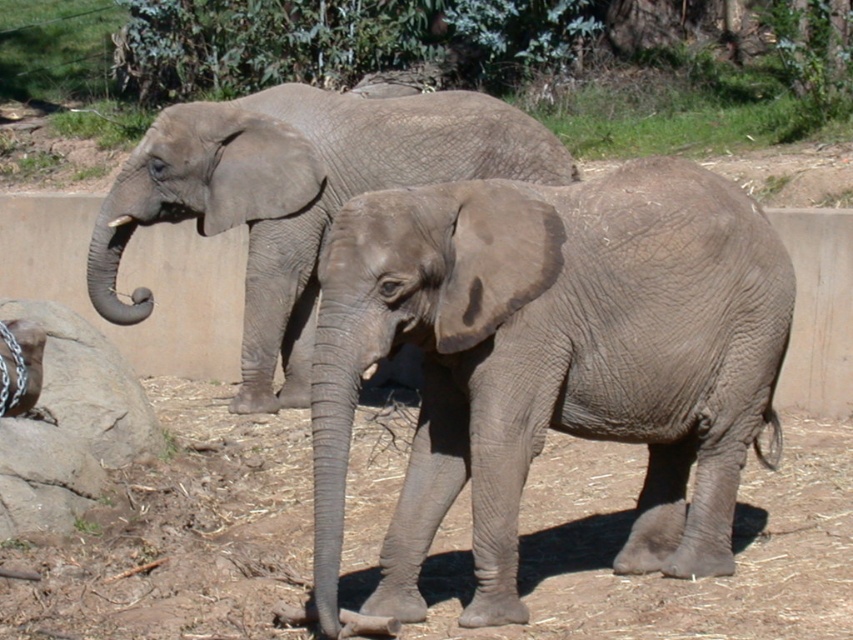
Is gray matte elephant at center to the right of gray matte elephant at upper left from the viewer's perspective?

Correct, you'll find gray matte elephant at center to the right of gray matte elephant at upper left.

Can you confirm if gray matte elephant at center is taller than gray matte elephant at upper left?

In fact, gray matte elephant at center may be shorter than gray matte elephant at upper left.

In the scene shown: Who is more distant from viewer, (732,561) or (252,161)?

Point (252,161)

This screenshot has width=853, height=640. I want to click on gray matte elephant at center, so click(x=550, y=360).

Who is lower down, gray matte elephant at center or brown dirt at lower center?

brown dirt at lower center is lower down.

The height and width of the screenshot is (640, 853). Describe the element at coordinates (550, 360) in the screenshot. I see `gray matte elephant at center` at that location.

Where is `gray matte elephant at center`? The image size is (853, 640). gray matte elephant at center is located at coordinates (550, 360).

Does point (566, 481) come closer to viewer compared to point (260, 266)?

Yes, it is.

Consider the image. Which is above, brown dirt at lower center or gray matte elephant at upper left?

gray matte elephant at upper left is higher up.

Does point (160, 387) lie behind point (339, 189)?

Yes, point (160, 387) is farther from viewer.

The width and height of the screenshot is (853, 640). Identify the location of brown dirt at lower center. (663, 577).